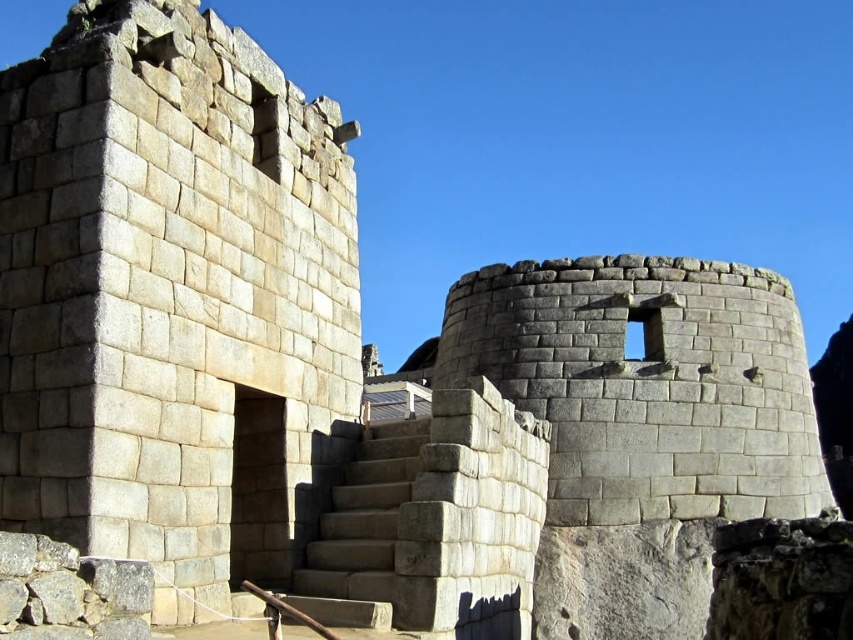
Question: Can you confirm if gray stone wall at center is wider than gray stone stairs at center?

Choices:
 (A) yes
 (B) no

Answer: (A)

Question: Is the position of gray stone wall at center more distant than that of gray stone stairs at center?

Choices:
 (A) no
 (B) yes

Answer: (A)

Question: Is gray stone wall at center bigger than gray stone stairs at center?

Choices:
 (A) yes
 (B) no

Answer: (A)

Question: Among these objects, which one is farthest from the camera?

Choices:
 (A) gray stone wall at center
 (B) gray stone stairs at center

Answer: (B)